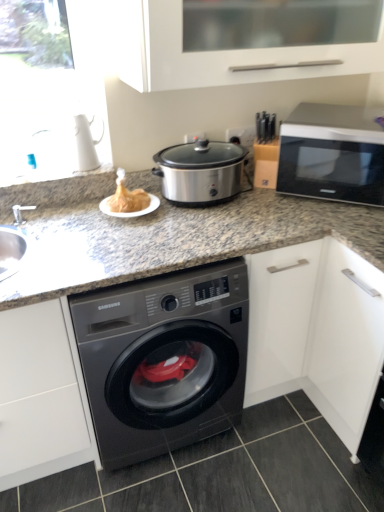
Question: Is white matte cabinet at upper center taller than black glossy washing machine at center?

Choices:
 (A) no
 (B) yes

Answer: (A)

Question: Can you confirm if white matte cabinet at upper center is bigger than black glossy washing machine at center?

Choices:
 (A) no
 (B) yes

Answer: (A)

Question: From a real-world perspective, is white matte cabinet at upper center below black glossy washing machine at center?

Choices:
 (A) no
 (B) yes

Answer: (A)

Question: Is white matte cabinet at upper center not inside black glossy washing machine at center?

Choices:
 (A) yes
 (B) no

Answer: (A)

Question: Can you confirm if white matte cabinet at upper center is positioned to the left of black glossy washing machine at center?

Choices:
 (A) no
 (B) yes

Answer: (A)

Question: Visually, is stainless steel slow cooker at center positioned to the left or to the right of black glossy washing machine at center?

Choices:
 (A) left
 (B) right

Answer: (B)

Question: From a real-world perspective, relative to black glossy washing machine at center, is stainless steel slow cooker at center vertically above or below?

Choices:
 (A) below
 (B) above

Answer: (B)

Question: In terms of size, does stainless steel slow cooker at center appear bigger or smaller than black glossy washing machine at center?

Choices:
 (A) big
 (B) small

Answer: (B)

Question: Which is correct: stainless steel slow cooker at center is inside black glossy washing machine at center, or outside of it?

Choices:
 (A) inside
 (B) outside

Answer: (B)

Question: Considering the positions of dark gray tile at lower center and granite gray countertop at center in the image, is dark gray tile at lower center wider or thinner than granite gray countertop at center?

Choices:
 (A) thin
 (B) wide

Answer: (B)

Question: From a real-world perspective, relative to granite gray countertop at center, is dark gray tile at lower center vertically above or below?

Choices:
 (A) below
 (B) above

Answer: (A)

Question: Which is correct: dark gray tile at lower center is inside granite gray countertop at center, or outside of it?

Choices:
 (A) inside
 (B) outside

Answer: (B)

Question: From the image's perspective, is dark gray tile at lower center located above or below granite gray countertop at center?

Choices:
 (A) above
 (B) below

Answer: (B)

Question: From a real-world perspective, is black glossy washing machine at center above or below silver metallic microwave at upper right?

Choices:
 (A) below
 (B) above

Answer: (A)

Question: In the image, is black glossy washing machine at center positioned in front of or behind silver metallic microwave at upper right?

Choices:
 (A) front
 (B) behind

Answer: (A)